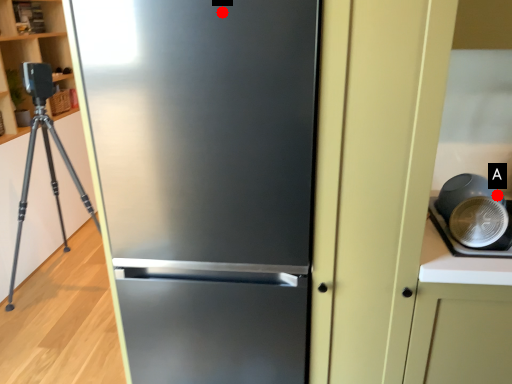
Question: Two points are circled on the image, labeled by A and B beside each circle. Which of the following is the closest to the observer?

Choices:
 (A) A is closer
 (B) B is closer

Answer: (B)